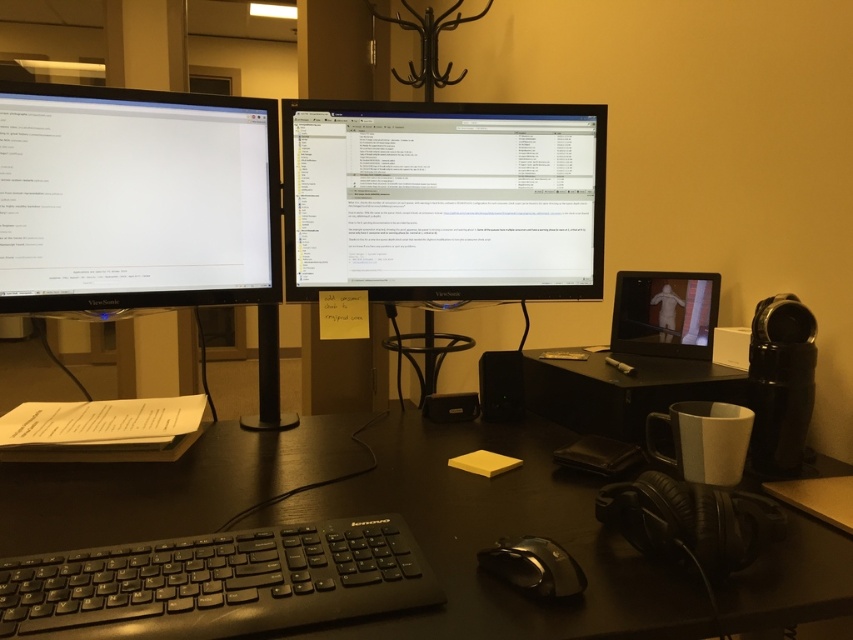
Question: Which of these objects is positioned closest to the black matte keyboard at center?

Choices:
 (A) matte black monitor at left
 (B) matte black tablet at center

Answer: (A)

Question: Estimate the real-world distances between objects in this image. Which object is closer to the black plastic speaker at center?

Choices:
 (A) black matte keyboard at center
 (B) black glossy monitor at center
 (C) black glossy mouse at center
 (D) matte black monitor at left

Answer: (B)

Question: Is black matte keyboard at center to the right of black glossy mouse at center from the viewer's perspective?

Choices:
 (A) no
 (B) yes

Answer: (A)

Question: Which of the following is the farthest from the observer?

Choices:
 (A) (524, 561)
 (B) (515, 412)
 (C) (45, 193)
 (D) (374, 524)

Answer: (B)

Question: Can you confirm if matte black monitor at left is positioned to the right of black glossy mouse at center?

Choices:
 (A) no
 (B) yes

Answer: (A)

Question: Observing the image, what is the correct spatial positioning of black glossy monitor at center in reference to black plastic speaker at center?

Choices:
 (A) left
 (B) right

Answer: (A)